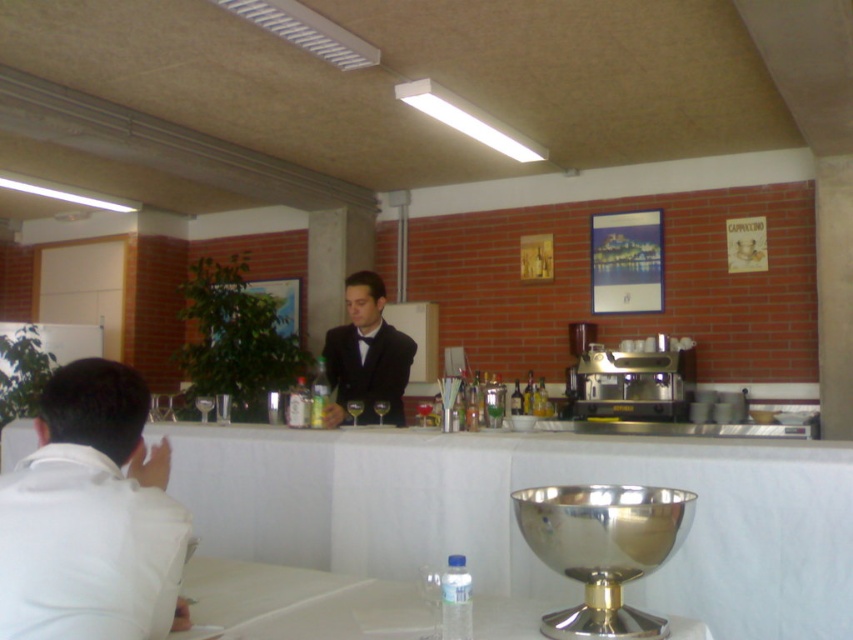
Find the location of `white matte shirt at left`. white matte shirt at left is located at coordinates [x=91, y=516].

Who is more distant from viewer, (131, 609) or (397, 401)?

The point (397, 401) is more distant.

Between point (160, 449) and point (364, 384), which one is positioned behind?

The point (364, 384) is behind.

Where is `white matte shirt at left`? The height and width of the screenshot is (640, 853). white matte shirt at left is located at coordinates [x=91, y=516].

Can you confirm if white fabric table at center is bigger than white matte shirt at left?

Correct, white fabric table at center is larger in size than white matte shirt at left.

Which of these two, white fabric table at center or white matte shirt at left, stands shorter?

white matte shirt at left is shorter.

This screenshot has width=853, height=640. Find the location of `white fabric table at center`. white fabric table at center is located at coordinates (514, 518).

Is white fabric table at center positioned in front of black satin suit at center?

Yes, it is.

From the picture: Who is positioned more to the right, white fabric table at center or black satin suit at center?

From the viewer's perspective, white fabric table at center appears more on the right side.

Does point (367, 552) come behind point (392, 400)?

No, it is in front of (392, 400).

Where is `white fabric table at center`? The image size is (853, 640). white fabric table at center is located at coordinates (514, 518).